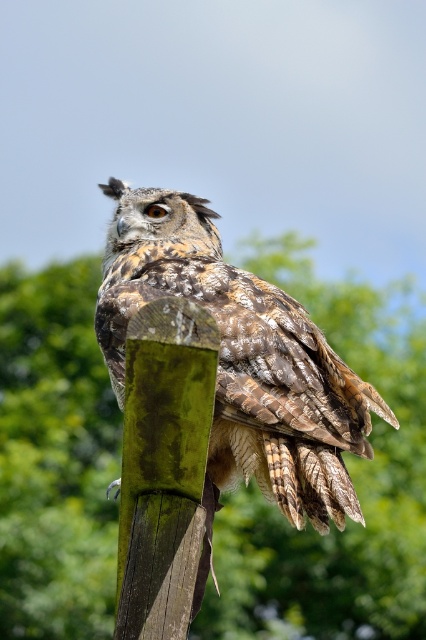
Question: Can you confirm if green mossy post at center is smaller than camouflage feathered owl at center?

Choices:
 (A) no
 (B) yes

Answer: (B)

Question: Which of the following is the closest to the observer?

Choices:
 (A) (265, 460)
 (B) (9, 602)

Answer: (A)

Question: Is green mossy post at center behind camouflage feathered owl at center?

Choices:
 (A) no
 (B) yes

Answer: (B)

Question: Which object appears farthest from the camera in this image?

Choices:
 (A) green mossy post at center
 (B) camouflage feathered owl at center

Answer: (A)

Question: Which object appears closest to the camera in this image?

Choices:
 (A) camouflage feathered owl at center
 (B) green mossy post at center

Answer: (A)

Question: Can you confirm if green mossy post at center is smaller than camouflage feathered owl at center?

Choices:
 (A) yes
 (B) no

Answer: (A)